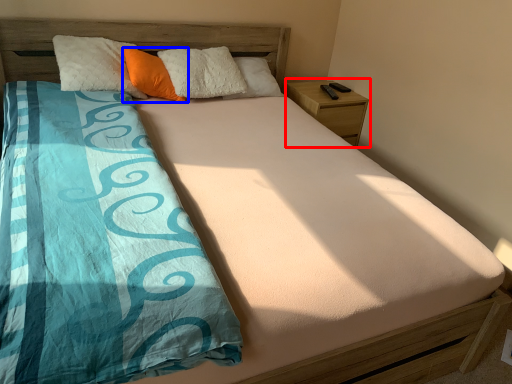
Question: Which point is closer to the camera, nightstand (highlighted by a red box) or pillow (highlighted by a blue box)?

Choices:
 (A) nightstand
 (B) pillow

Answer: (B)